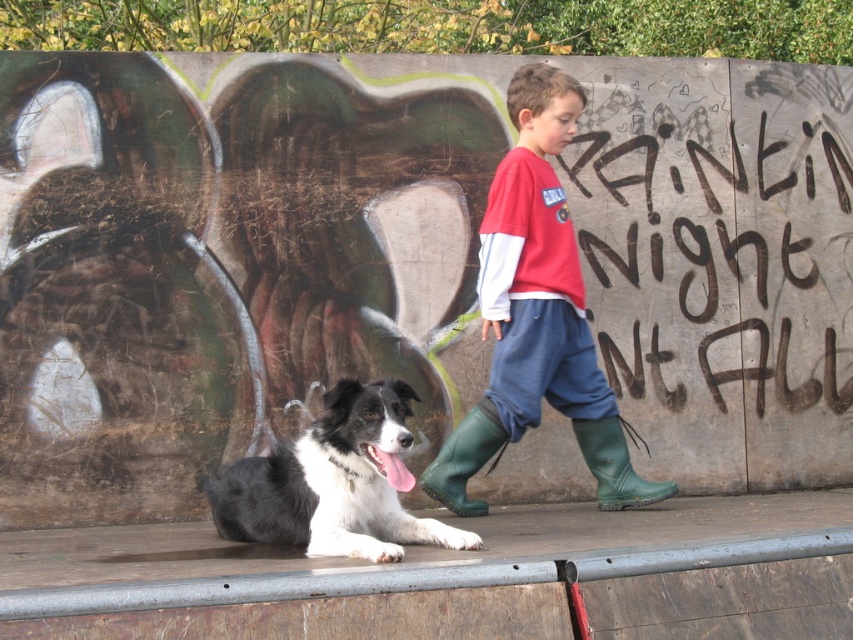
Question: Does matte red shirt at center have a larger size compared to green rubber boot at lower right?

Choices:
 (A) yes
 (B) no

Answer: (A)

Question: Which point is closer to the camera?

Choices:
 (A) (434, 497)
 (B) (491, 273)
 (C) (346, 480)
 (D) (604, 499)

Answer: (C)

Question: Estimate the real-world distances between objects in this image. Which object is closer to the green rubber boot at lower right?

Choices:
 (A) matte red shirt at center
 (B) black and white fur at lower left

Answer: (A)

Question: Which of the following is the closest to the observer?

Choices:
 (A) (376, 467)
 (B) (625, 467)
 (C) (555, 109)

Answer: (A)

Question: Can you confirm if matte red shirt at center is bigger than black and white fur at lower left?

Choices:
 (A) no
 (B) yes

Answer: (B)

Question: Is black and white fur at lower left positioned behind green rubber boot at lower center?

Choices:
 (A) yes
 (B) no

Answer: (B)